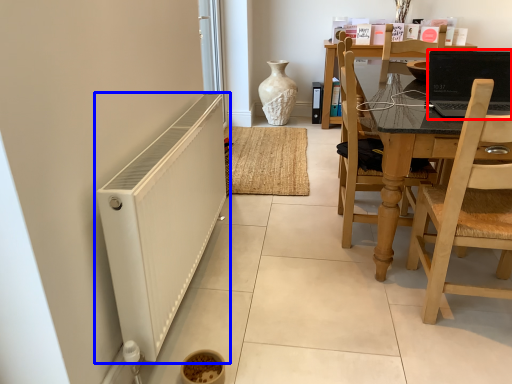
Question: Which of the following is the closest to the observer, laptop (highlighted by a red box) or radiator (highlighted by a blue box)?

Choices:
 (A) laptop
 (B) radiator

Answer: (B)